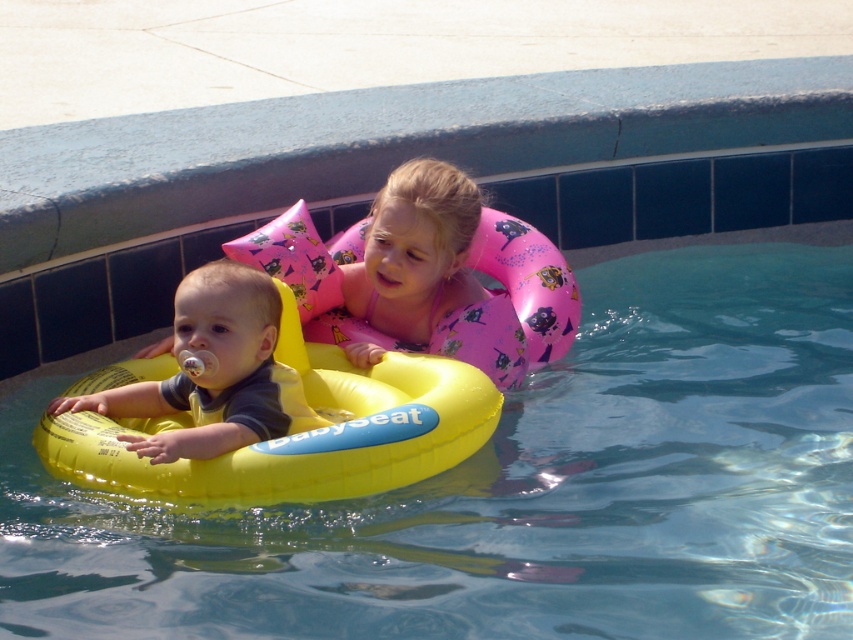
In the scene shown: You are a lifeguard standing at the edge of the pool. You notice a small floating toy that is exactly at point coordinates (x=426, y=280). Which object is the toy closest to?

The small floating toy at point coordinates (x=426, y=280) is closest to the pink rubber ring at center.

You are a lifeguard who needs to ensure safety equipment is properly sized. The yellow rubber ring at left is for a toddler, and the pink rubber ring at center is for an older child. Based on their sizes, which ring is more appropriate for the older child?

The pink rubber ring at center is more appropriate for the older child because it occupies less space than the yellow rubber ring at left, making it easier for the older child to handle and maneuver.